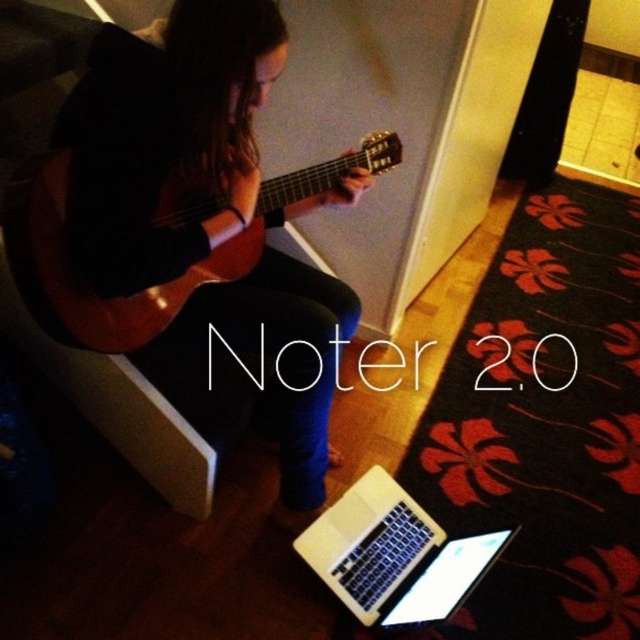
You are standing in the room and want to place a small plant pot that is 2 feet tall on the floor. The point where you want to place it is at coordinates point (209, 241). Considering the distance from the camera to that point is 3.90 feet, will the plant pot be visible from the camera position?

The distance of point (209, 241) from camera is 3.90 feet. The plant pot is 2 feet tall. Since the height of the plant pot is less than the distance from the camera, it will be visible as long as there are no obstructions. The scene description mentions the person is seated playing a guitar with a laptop on the floor, but the exact placement isn not specified. Assuming no direct blockage, the plant pot at point (209, 241) would likely be visible from the camera position.

You are a photographer trying to capture a closeup of the white glossy laptop at lower center without the wooden acoustic guitar at center blocking the view. Is the laptop visible from above the guitar?

The wooden acoustic guitar at center is positioned over white glossy laptop at lower center, so the laptop is not visible from above the guitar.

You are a photographer trying to capture a clear photo of the matte black guitar at center and the wooden acoustic guitar at center. Since you want both guitars to be in focus, you need to adjust your camera settings. Which guitar should you focus on to ensure both are sharp?

You should focus on the matte black guitar at center because it is closer to the viewer than the wooden acoustic guitar at center. By focusing on the closer object, the depth of field will extend further back, increasing the likelihood that both guitars are in focus.